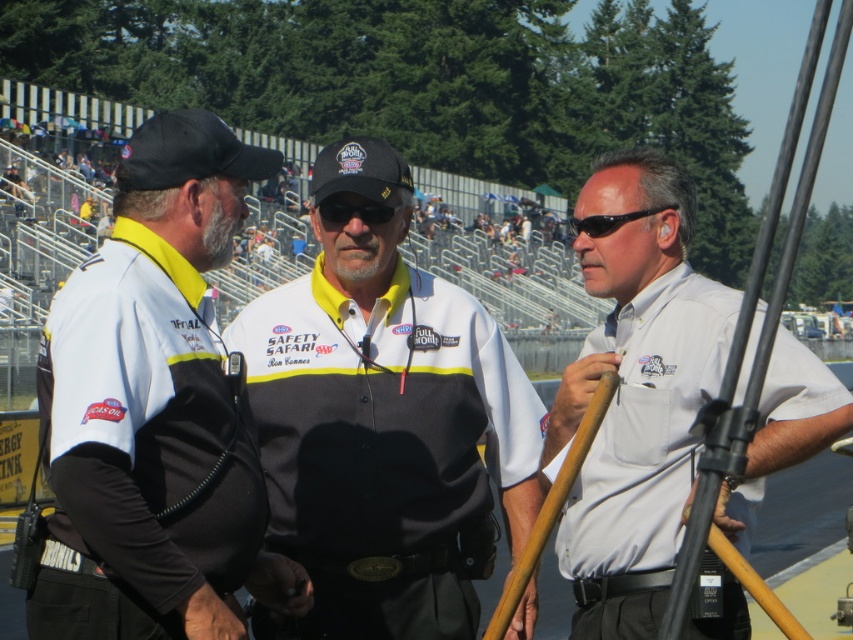
Between black matte sunglasses at center and black plastic sunglasses at center, which one has less height?

With less height is black matte sunglasses at center.

In the scene shown: Who is taller, black matte sunglasses at center or black plastic sunglasses at center?

black plastic sunglasses at center

Describe the element at coordinates (352, 211) in the screenshot. I see `black matte sunglasses at center` at that location.

You are a GUI agent. You are given a task and a screenshot of the screen. Output one action in this format:
    pyautogui.click(x=<x>, y=<y>)
    Task: Click on the black matte sunglasses at center
    
    Given the screenshot: What is the action you would take?
    pyautogui.click(x=352, y=211)

Does white matte shirt at center have a larger size compared to black plastic sunglasses at center?

No, white matte shirt at center is not bigger than black plastic sunglasses at center.

Does white matte shirt at center lie in front of black plastic sunglasses at center?

Yes, white matte shirt at center is closer to the viewer.

Locate an element on the screen. white matte shirt at center is located at coordinates (636, 396).

Does black uniform at center have a greater width compared to black matte sunglasses at center?

Correct, the width of black uniform at center exceeds that of black matte sunglasses at center.

Which is below, black uniform at center or black matte sunglasses at center?

black uniform at center is below.

This screenshot has height=640, width=853. Find the location of `black uniform at center`. black uniform at center is located at coordinates (154, 410).